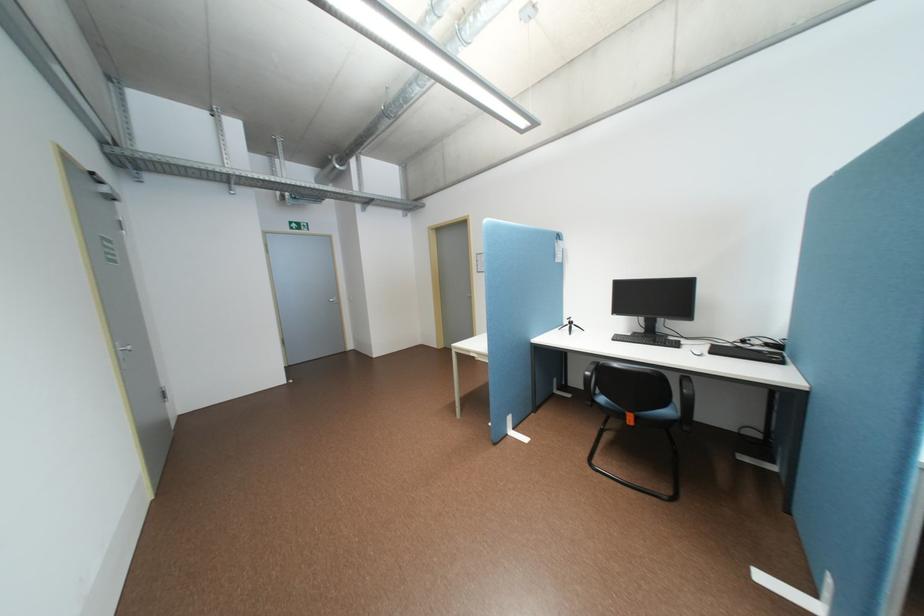
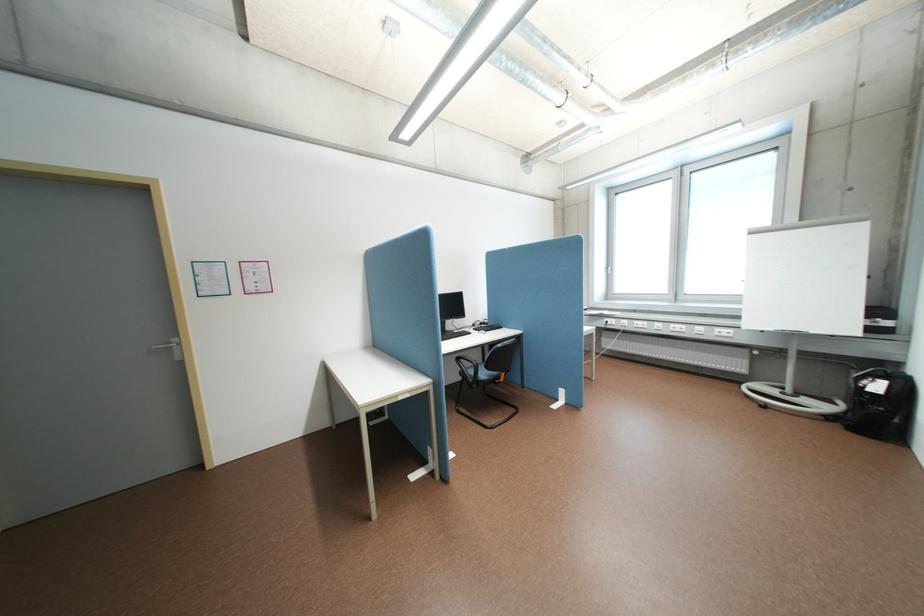
Where in the second image is the point corresponding to (x=480, y=351) from the first image?

(407, 395)